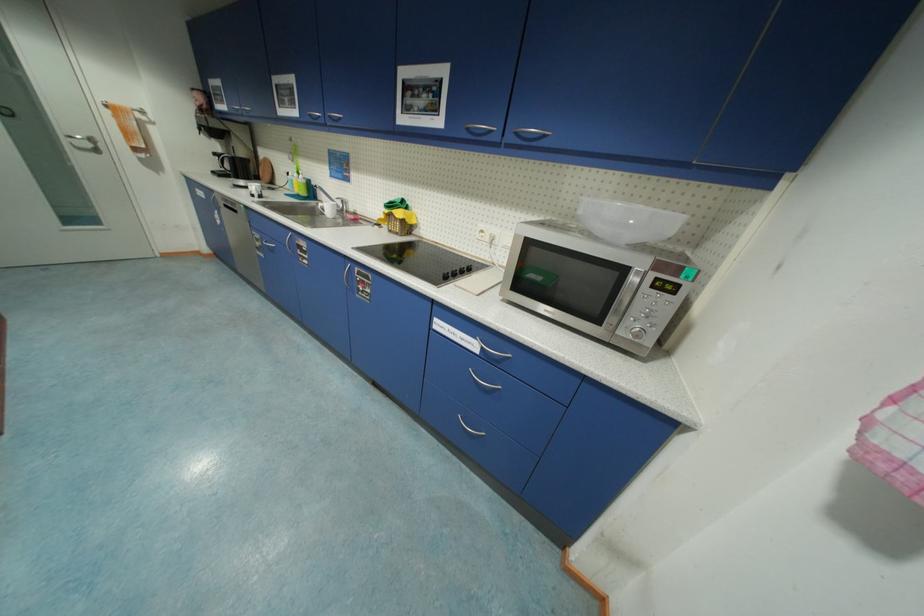
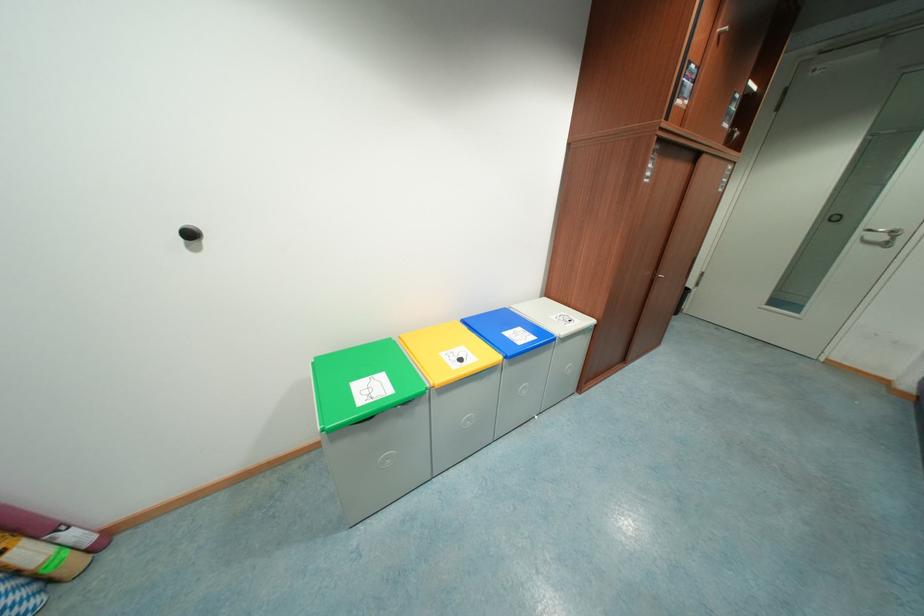
The first image is from the beginning of the video and the second image is from the end. How did the camera likely rotate when shooting the video?

The camera rotated toward left-down.